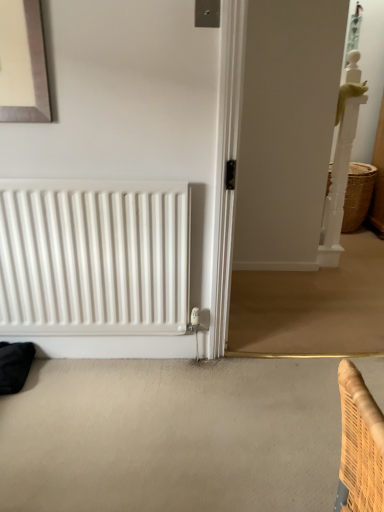
Question: From the image's perspective, would you say white glossy screen door at right is positioned over white matte radiator at lower left?

Choices:
 (A) yes
 (B) no

Answer: (A)

Question: Considering the relative sizes of white glossy screen door at right and white matte radiator at lower left in the image provided, is white glossy screen door at right smaller than white matte radiator at lower left?

Choices:
 (A) no
 (B) yes

Answer: (A)

Question: Considering the relative sizes of white glossy screen door at right and white matte radiator at lower left in the image provided, is white glossy screen door at right wider than white matte radiator at lower left?

Choices:
 (A) no
 (B) yes

Answer: (B)

Question: Is white glossy screen door at right bigger than white matte radiator at lower left?

Choices:
 (A) no
 (B) yes

Answer: (B)

Question: Is white glossy screen door at right turned away from white matte radiator at lower left?

Choices:
 (A) no
 (B) yes

Answer: (A)

Question: From the image's perspective, is woven straw basket at right positioned above or below white matte radiator at lower left?

Choices:
 (A) below
 (B) above

Answer: (B)

Question: Based on their positions, is woven straw basket at right located to the left or right of white matte radiator at lower left?

Choices:
 (A) right
 (B) left

Answer: (A)

Question: From a real-world perspective, is woven straw basket at right above or below white matte radiator at lower left?

Choices:
 (A) below
 (B) above

Answer: (A)

Question: Is woven straw basket at right wider or thinner than white matte radiator at lower left?

Choices:
 (A) thin
 (B) wide

Answer: (B)

Question: Looking at their shapes, would you say white glossy screen door at right is wider or thinner than woven straw basket at right?

Choices:
 (A) thin
 (B) wide

Answer: (A)

Question: From a real-world perspective, is white glossy screen door at right above or below woven straw basket at right?

Choices:
 (A) below
 (B) above

Answer: (B)

Question: Based on their positions, is white glossy screen door at right located to the left or right of woven straw basket at right?

Choices:
 (A) left
 (B) right

Answer: (A)

Question: Looking at the image, does white glossy screen door at right seem bigger or smaller compared to woven straw basket at right?

Choices:
 (A) small
 (B) big

Answer: (B)

Question: From a real-world perspective, relative to white matte radiator at lower left, is white glossy screen door at right vertically above or below?

Choices:
 (A) above
 (B) below

Answer: (A)

Question: Visually, is white glossy screen door at right positioned to the left or to the right of white matte radiator at lower left?

Choices:
 (A) left
 (B) right

Answer: (B)